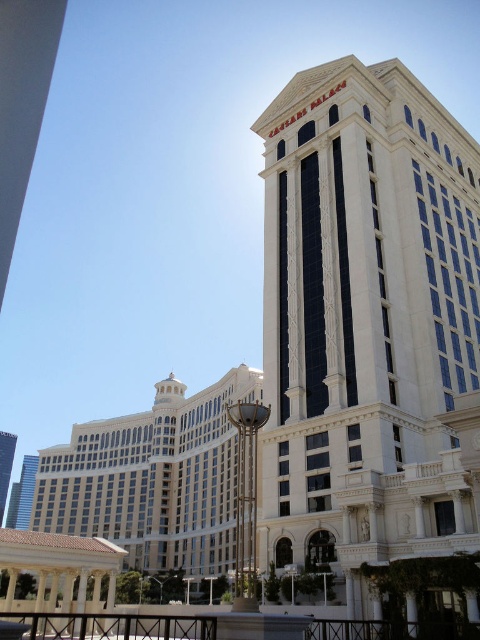
Question: Which point appears farthest from the camera in this image?

Choices:
 (A) (314, 529)
 (B) (175, 392)

Answer: (B)

Question: Which object is the farthest from the white marble tower at center?

Choices:
 (A) white marble building at center
 (B) beige stone building at lower left

Answer: (A)

Question: Is white marble building at center below beige stone building at lower left?

Choices:
 (A) yes
 (B) no

Answer: (B)

Question: Is beige stone building at lower left positioned before white marble tower at center?

Choices:
 (A) no
 (B) yes

Answer: (B)

Question: Among these points, which one is farthest from the camera?

Choices:
 (A) (226, 502)
 (B) (6, 492)
 (C) (424, 120)

Answer: (B)

Question: Is white marble building at center positioned behind beige stone building at lower left?

Choices:
 (A) no
 (B) yes

Answer: (A)